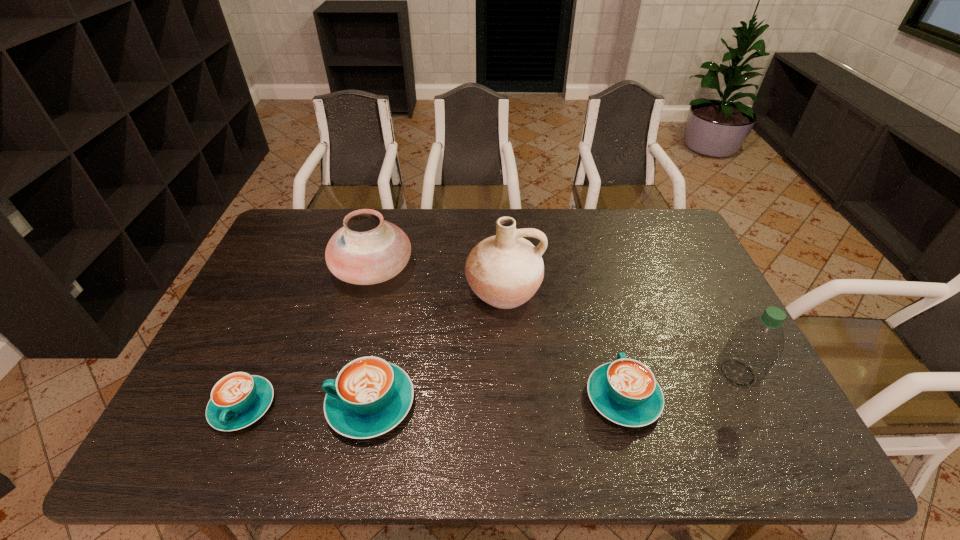
Identify the location of object positioned at the left edge. (239, 399).

At what (x,y) coordinates should I click in order to perform the action: click on object present at the right edge. Please return your answer as a coordinate pair (x, y). Looking at the image, I should click on (754, 346).

Locate an element on the screen. The image size is (960, 540). object located in the near left corner section of the desktop is located at coordinates (239, 399).

What are the coordinates of `object situated at the near right corner` in the screenshot? It's located at (754, 346).

The image size is (960, 540). In the image, there is a desktop. Find the location of `free space at the far edge`. free space at the far edge is located at coordinates (585, 225).

Where is `vacant space at the left edge of the desktop`? vacant space at the left edge of the desktop is located at coordinates (248, 333).

The width and height of the screenshot is (960, 540). In the image, there is a desktop. In order to click on vacant space at the right edge in this screenshot , I will do `click(660, 291)`.

The height and width of the screenshot is (540, 960). In the image, there is a desktop. Identify the location of vacant space at the far left corner. (273, 240).

This screenshot has height=540, width=960. Identify the location of blank space at the near left corner of the desktop. (195, 403).

What are the coordinates of `vacant space at the near right corner` in the screenshot? It's located at (706, 396).